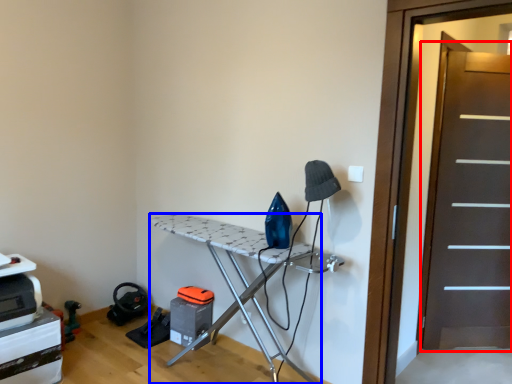
Question: Which of the following is the closest to the observer, screen door (highlighted by a red box) or furniture (highlighted by a blue box)?

Choices:
 (A) screen door
 (B) furniture

Answer: (B)